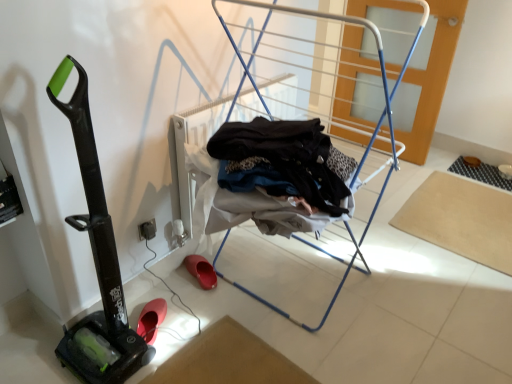
Question: From a real-world perspective, is metallic blue drying rack at center on top of black rubber vacuum at left?

Choices:
 (A) yes
 (B) no

Answer: (A)

Question: Is metallic blue drying rack at center with black rubber vacuum at left?

Choices:
 (A) no
 (B) yes

Answer: (A)

Question: Is metallic blue drying rack at center positioned far away from black rubber vacuum at left?

Choices:
 (A) no
 (B) yes

Answer: (A)

Question: Does metallic blue drying rack at center have a lesser height compared to black rubber vacuum at left?

Choices:
 (A) yes
 (B) no

Answer: (B)

Question: Is metallic blue drying rack at center not inside black rubber vacuum at left?

Choices:
 (A) yes
 (B) no

Answer: (A)

Question: From their relative heights in the image, would you say black rubber vacuum at left is taller or shorter than beige fabric yoga mat at lower right?

Choices:
 (A) tall
 (B) short

Answer: (A)

Question: From the image's perspective, is black rubber vacuum at left positioned above or below beige fabric yoga mat at lower right?

Choices:
 (A) below
 (B) above

Answer: (A)

Question: In the image, is black rubber vacuum at left positioned in front of or behind beige fabric yoga mat at lower right?

Choices:
 (A) behind
 (B) front

Answer: (B)

Question: Looking at the image, does black rubber vacuum at left seem bigger or smaller compared to beige fabric yoga mat at lower right?

Choices:
 (A) small
 (B) big

Answer: (B)

Question: From a real-world perspective, is beige fabric yoga mat at lower right physically located above or below metallic blue drying rack at center?

Choices:
 (A) above
 (B) below

Answer: (B)

Question: Based on their sizes in the image, would you say beige fabric yoga mat at lower right is bigger or smaller than metallic blue drying rack at center?

Choices:
 (A) small
 (B) big

Answer: (A)

Question: Which is correct: beige fabric yoga mat at lower right is inside metallic blue drying rack at center, or outside of it?

Choices:
 (A) outside
 (B) inside

Answer: (A)

Question: Considering their positions, is beige fabric yoga mat at lower right located in front of or behind metallic blue drying rack at center?

Choices:
 (A) front
 (B) behind

Answer: (B)

Question: Considering the relative positions of rubber/matte clog at lower left, which is the first footwear in right-to-left order, and metallic blue drying rack at center in the image provided, is rubber/matte clog at lower left, which is the first footwear in right-to-left order, to the left or to the right of metallic blue drying rack at center?

Choices:
 (A) right
 (B) left

Answer: (B)

Question: In terms of size, does rubber/matte clog at lower left, arranged as the 2th footwear when ordered from the bottom, appear bigger or smaller than metallic blue drying rack at center?

Choices:
 (A) small
 (B) big

Answer: (A)